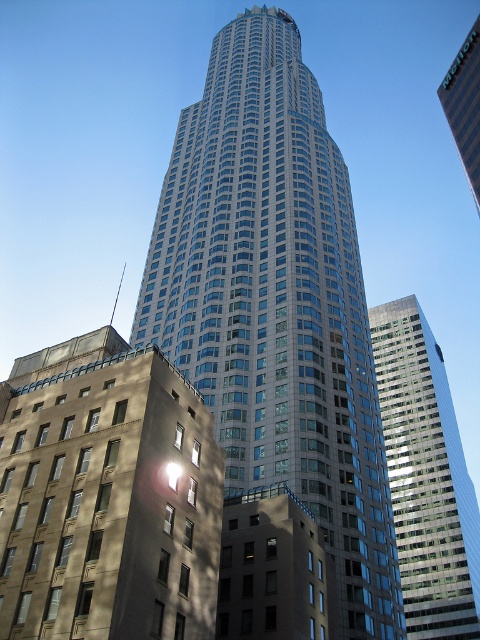
Question: Which object is the farthest from the glassy silver skyscraper at center?

Choices:
 (A) glassy steel skyscraper at center
 (B) beige concrete building at lower left
 (C) glassy reflective skyscraper at right

Answer: (B)

Question: Among these points, which one is farthest from the camera?

Choices:
 (A) (467, 484)
 (B) (141, 536)

Answer: (A)

Question: Does glassy silver skyscraper at center lie behind glassy reflective skyscraper at right?

Choices:
 (A) yes
 (B) no

Answer: (B)

Question: Where is beige concrete building at lower left located in relation to glassy reflective skyscraper at right in the image?

Choices:
 (A) above
 (B) below

Answer: (A)

Question: Estimate the real-world distances between objects in this image. Which object is farther from the beige concrete building at lower left?

Choices:
 (A) glassy reflective skyscraper at right
 (B) glassy steel skyscraper at center

Answer: (B)

Question: Considering the relative positions of beige concrete building at lower left and glassy reflective skyscraper at right in the image provided, where is beige concrete building at lower left located with respect to glassy reflective skyscraper at right?

Choices:
 (A) right
 (B) left

Answer: (B)